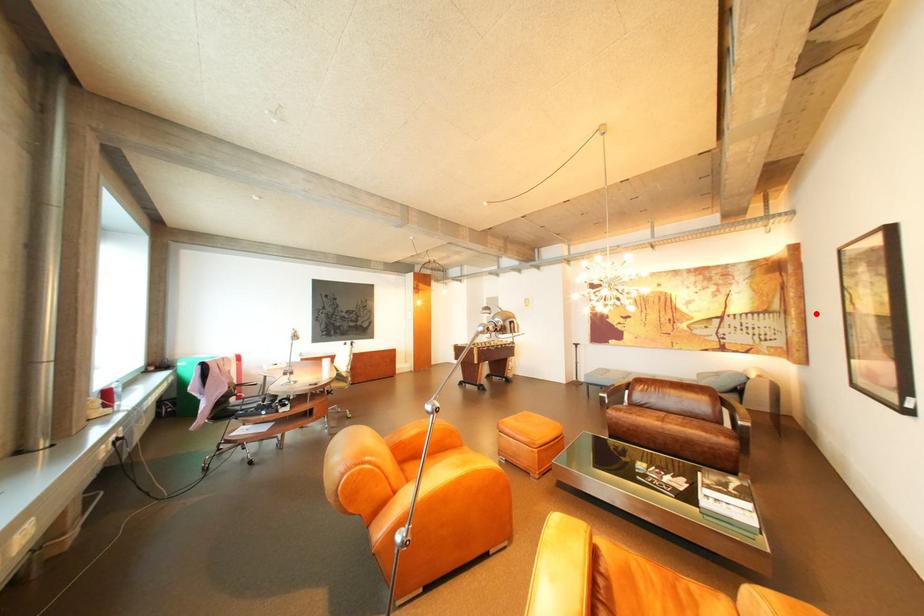
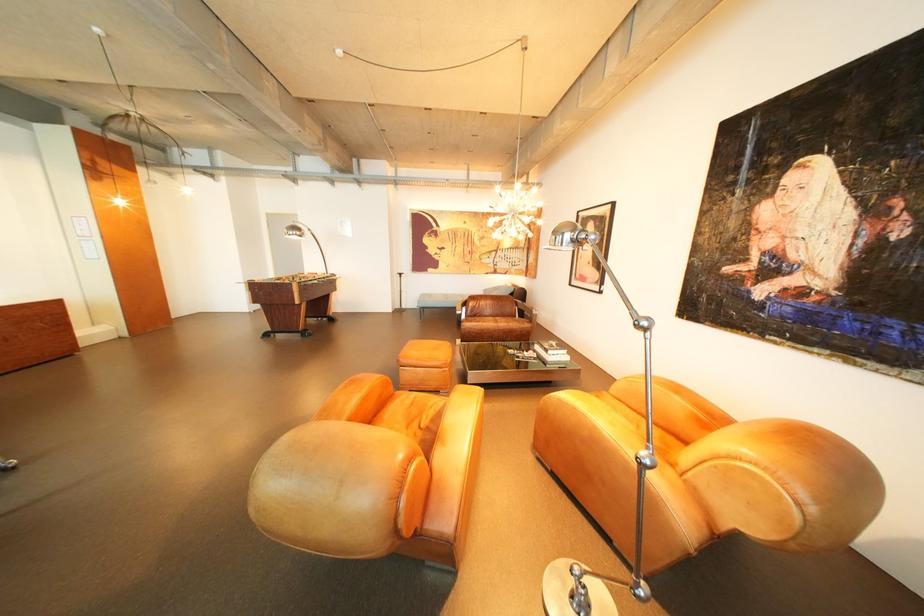
Where in the second image is the point corresponding to the highlighted location from the first image?

(552, 249)